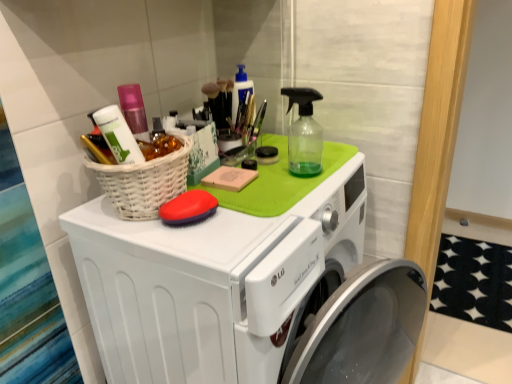
Measure the distance between point [106,189] and camera.

Point [106,189] is 31.77 inches away from camera.

The image size is (512, 384). Find the location of `white plastic washing machine at upper center`. white plastic washing machine at upper center is located at coordinates (248, 294).

Which is behind, red rubber brush at center or white plastic washing machine at upper center?

red rubber brush at center is further from the camera.

The height and width of the screenshot is (384, 512). Identify the location of soap behind the white plastic washing machine at upper center. (188, 208).

Considering the points (170, 216) and (354, 363), which point is behind, point (170, 216) or point (354, 363)?

The point (354, 363) is more distant.

Considering the positions of point (348, 206) and point (172, 173), is point (348, 206) closer or farther from the camera than point (172, 173)?

Point (348, 206) is positioned farther from the camera compared to point (172, 173).

How different are the orientations of white plastic washing machine at upper center and white wicker basket at upper left in degrees?

The angle between the facing direction of white plastic washing machine at upper center and the facing direction of white wicker basket at upper left is 0.107 degrees.

Considering the sizes of objects white plastic washing machine at upper center and white wicker basket at upper left in the image provided, who is wider, white plastic washing machine at upper center or white wicker basket at upper left?

white plastic washing machine at upper center is wider.

Is white plastic washing machine at upper center placed right next to white wicker basket at upper left?

No, white plastic washing machine at upper center is not with white wicker basket at upper left.

Which point is more forward, (156, 180) or (197, 213)?

The point (156, 180) is closer.

Which of these two, white wicker basket at upper left or red rubber brush at center, stands shorter?

With less height is red rubber brush at center.

Which object is further away from the camera taking this photo, white wicker basket at upper left or red rubber brush at center?

Positioned behind is red rubber brush at center.

Is white wicker basket at upper left bigger than red rubber brush at center?

Yes.

From the image's perspective, would you say white plastic washing machine at upper center is shown under red rubber brush at center?

Yes, from the image's perspective, white plastic washing machine at upper center is below red rubber brush at center.

Which object is positioned more to the left, white plastic washing machine at upper center or red rubber brush at center?

Positioned to the left is red rubber brush at center.

Is white plastic washing machine at upper center in front of or behind red rubber brush at center in the image?

Clearly, white plastic washing machine at upper center is in front of red rubber brush at center.

How distant is white wicker basket at upper left from white plastic washing machine at upper center?

white wicker basket at upper left and white plastic washing machine at upper center are 12.72 inches apart.

Considering the sizes of white wicker basket at upper left and white plastic washing machine at upper center in the image, is white wicker basket at upper left wider or thinner than white plastic washing machine at upper center?

white wicker basket at upper left is thinner than white plastic washing machine at upper center.

From a real-world perspective, is white wicker basket at upper left above or below white plastic washing machine at upper center?

In terms of real-world spatial position, white wicker basket at upper left is above white plastic washing machine at upper center.

Is white wicker basket at upper left in front of or behind white plastic washing machine at upper center in the image?

Visually, white wicker basket at upper left is located behind white plastic washing machine at upper center.

Who is shorter, red rubber brush at center or white wicker basket at upper left?

With less height is red rubber brush at center.

Is white wicker basket at upper left a part of red rubber brush at center?

No, white wicker basket at upper left is located outside of red rubber brush at center.

Locate an element on the screen. This screenshot has height=384, width=512. washing machine on the right of the red rubber brush at center is located at coordinates (248, 294).

Locate an element on the screen. basket lying on the left of white plastic washing machine at upper center is located at coordinates (144, 182).

Based on their spatial positions, is white plastic washing machine at upper center or white wicker basket at upper left further from red rubber brush at center?

Among the two, white plastic washing machine at upper center is located further to red rubber brush at center.

From the image, which object appears to be farther from white plastic washing machine at upper center, white wicker basket at upper left or red rubber brush at center?

Based on the image, red rubber brush at center appears to be further to white plastic washing machine at upper center.

From the image, which object appears to be farther from white wicker basket at upper left, red rubber brush at center or white plastic washing machine at upper center?

white plastic washing machine at upper center lies further to white wicker basket at upper left than the other object.

Considering their positions, is white wicker basket at upper left positioned further to red rubber brush at center than white plastic washing machine at upper center?

Among the two, white plastic washing machine at upper center is located further to red rubber brush at center.

When comparing their distances from white wicker basket at upper left, does white plastic washing machine at upper center or red rubber brush at center seem closer?

Among the two, red rubber brush at center is located nearer to white wicker basket at upper left.

Looking at the image, which one is located closer to white plastic washing machine at upper center, red rubber brush at center or white wicker basket at upper left?

white wicker basket at upper left lies closer to white plastic washing machine at upper center than the other object.

This screenshot has height=384, width=512. Identify the location of soap that lies between white wicker basket at upper left and white plastic washing machine at upper center from top to bottom. (188, 208).